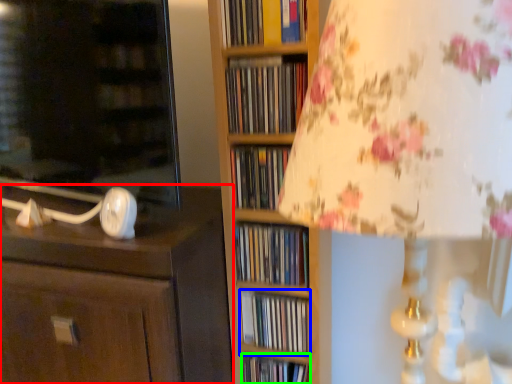
Question: Which object is the farthest from chest of drawers (highlighted by a red box)? Choose among these: book (highlighted by a blue box) or book (highlighted by a green box).

Choices:
 (A) book
 (B) book

Answer: (B)